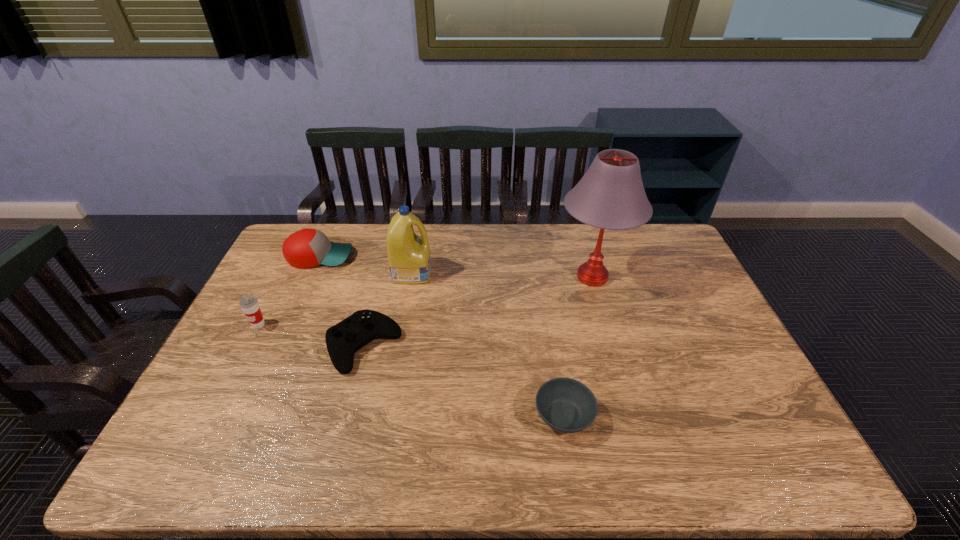
This screenshot has height=540, width=960. Identify the location of baseball cap that is at the left edge. (308, 247).

The width and height of the screenshot is (960, 540). What are the coordinates of `object positioned at the far left corner` in the screenshot? It's located at (308, 247).

Image resolution: width=960 pixels, height=540 pixels. Find the location of `free space at the far edge of the desktop`. free space at the far edge of the desktop is located at coordinates (452, 259).

Image resolution: width=960 pixels, height=540 pixels. In order to click on vacant area at the near edge in this screenshot , I will do `click(308, 441)`.

The height and width of the screenshot is (540, 960). I want to click on free space at the left edge of the desktop, so click(x=228, y=375).

Where is `vacant space at the right edge of the desktop`? The height and width of the screenshot is (540, 960). vacant space at the right edge of the desktop is located at coordinates (673, 276).

Image resolution: width=960 pixels, height=540 pixels. I want to click on vacant area at the far right corner, so click(665, 224).

Identify the location of free space between the third tallest object and the detergent. (335, 298).

Where is `vacant area that lies between the tallest object and the fifth shortest object`? The image size is (960, 540). vacant area that lies between the tallest object and the fifth shortest object is located at coordinates 502,274.

The image size is (960, 540). I want to click on vacant space that's between the fifth tallest object and the second tallest object, so click(388, 309).